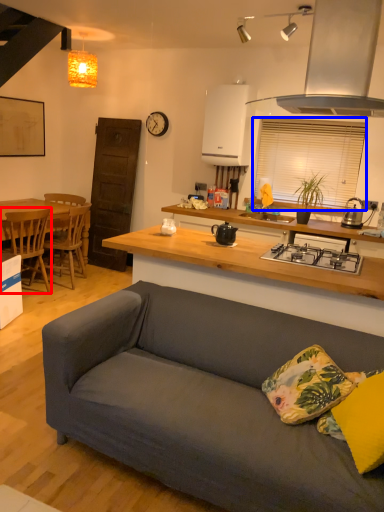
Question: Which object appears closest to the camera in this image, chair (highlighted by a red box) or window screen (highlighted by a blue box)?

Choices:
 (A) chair
 (B) window screen

Answer: (A)